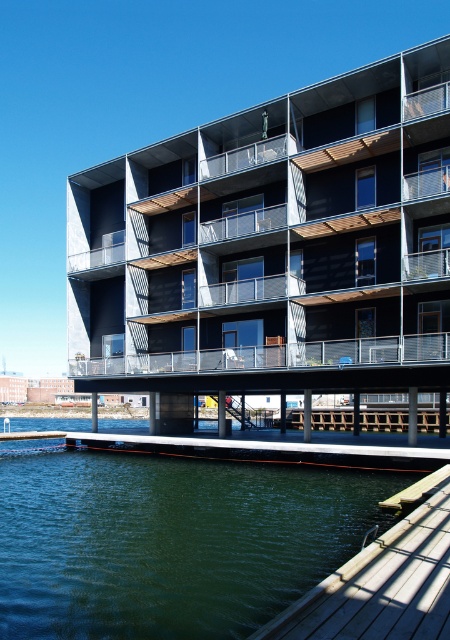
You are planning to host a small outdoor event and need to choose between the wooden dock at lower center and the wooden dock at lower right for setting up a 10x10 meter tent. Based on the scene description, which dock can accommodate the tent without overcrowding?

The wooden dock at lower center has a larger size compared to wooden dock at lower right, so it can accommodate the 10x10 meter tent without overcrowding.

You are a delivery drone with a wingspan of 1.5 meters. You need to fly between the wooden dock at lower center and the green water at lower left. Can you safely pass through the space between them without touching either?

The wooden dock at lower center and green water at lower left are 7.75 meters apart from each other. Since your wingspan is only 1.5 meters, you can safely pass through the space between them without any issues.

You are standing at the point labeled point (170, 540) in the image. Which object from the scene is located at this point?

The green water at lower left is located at point (170, 540).